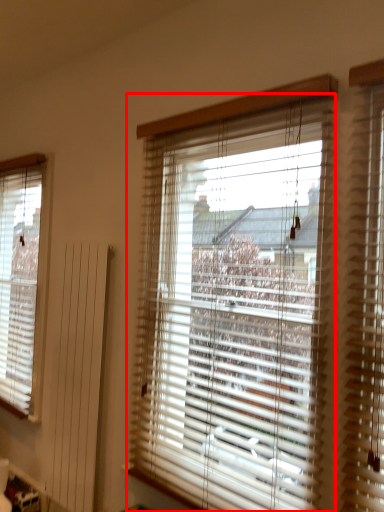
Question: From the image's perspective, where is window blind (annotated by the red box) located relative to window blind?

Choices:
 (A) above
 (B) below

Answer: (B)